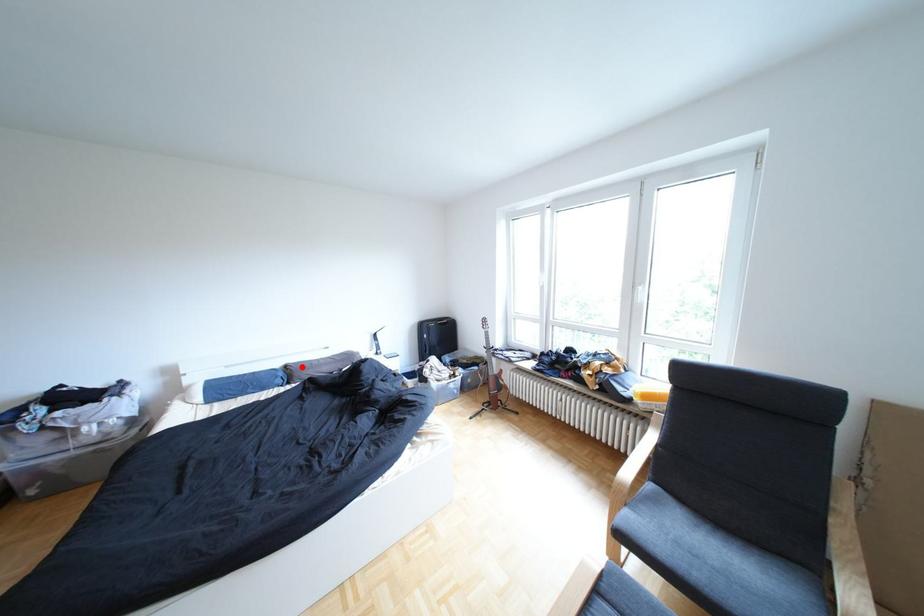
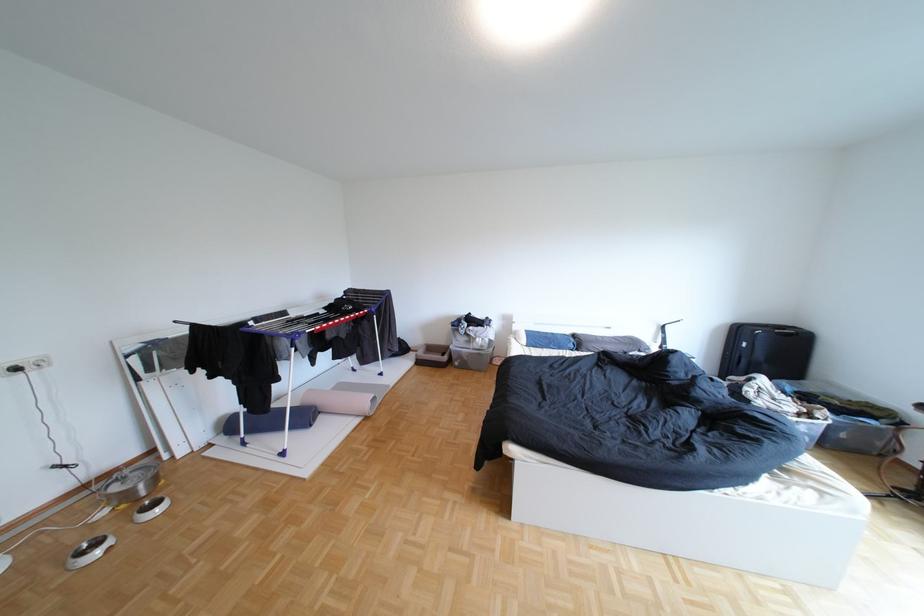
In the second image, find the point that corresponds to the highlighted location in the first image.

(590, 336)